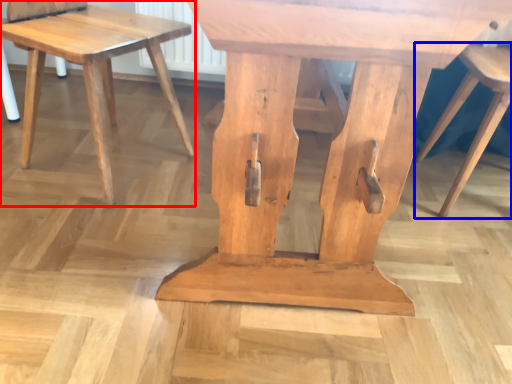
Question: Among these objects, which one is nearest to the camera, stool (highlighted by a red box) or stool (highlighted by a blue box)?

Choices:
 (A) stool
 (B) stool

Answer: (A)